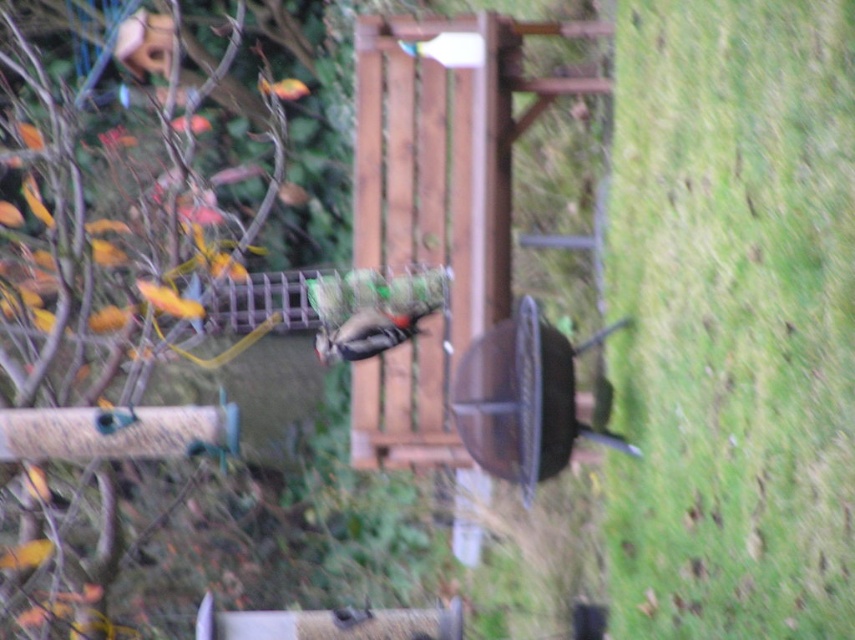
Question: Estimate the real-world distances between objects in this image. Which object is closer to the brown matte woodpecker at center?

Choices:
 (A) green grass at lower right
 (B) green matte bird feeder at left

Answer: (A)

Question: Does green matte bird feeder at left have a greater width compared to brown matte woodpecker at center?

Choices:
 (A) yes
 (B) no

Answer: (A)

Question: Which point appears farthest from the camera in this image?

Choices:
 (A) (664, 300)
 (B) (345, 332)

Answer: (B)

Question: Considering the relative positions of green grass at lower right and green matte bird feeder at left in the image provided, where is green grass at lower right located with respect to green matte bird feeder at left?

Choices:
 (A) below
 (B) above

Answer: (B)

Question: Which is farther from the green grass at lower right?

Choices:
 (A) green matte bird feeder at left
 (B) brown matte woodpecker at center

Answer: (A)

Question: Does green grass at lower right have a smaller size compared to green matte bird feeder at left?

Choices:
 (A) no
 (B) yes

Answer: (B)